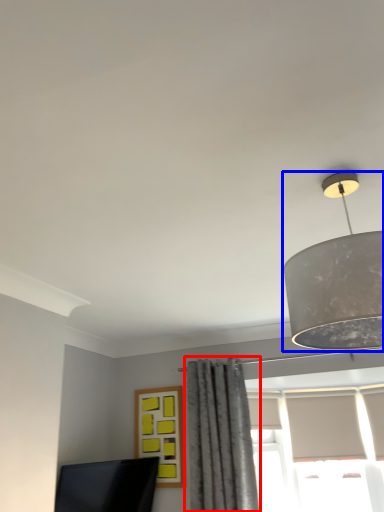
Question: Among these objects, which one is nearest to the camera, curtain (highlighted by a red box) or lamp (highlighted by a blue box)?

Choices:
 (A) curtain
 (B) lamp

Answer: (B)